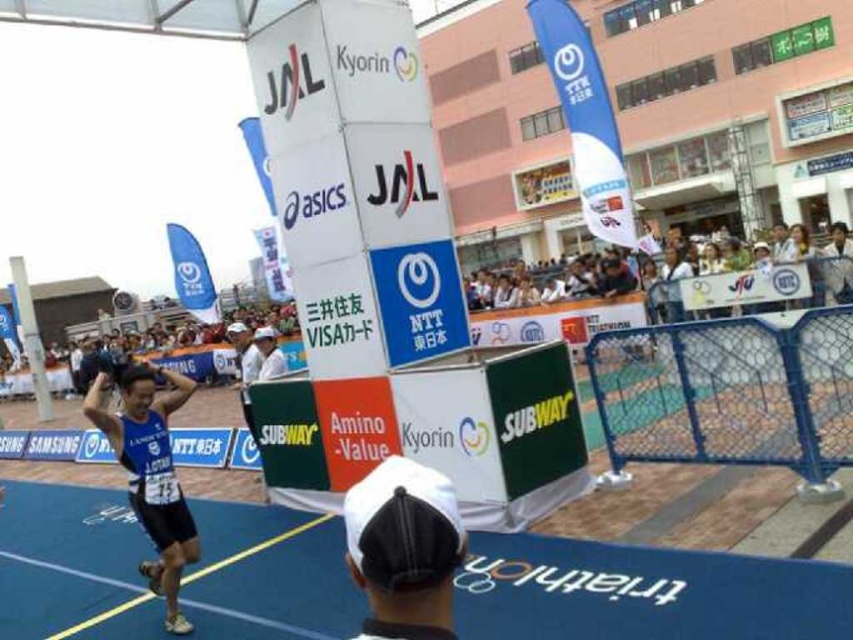
Question: Which of the following is the closest to the observer?

Choices:
 (A) white fabric shirt at center
 (B) blue fabric jersey at left
 (C) white matte cap at lower center

Answer: (C)

Question: Among these points, which one is farthest from the camera?

Choices:
 (A) (170, 528)
 (B) (244, 346)

Answer: (B)

Question: Which object appears closest to the camera in this image?

Choices:
 (A) white matte cap at lower center
 (B) blue fabric jersey at left

Answer: (A)

Question: Does white matte cap at lower center appear on the right side of blue fabric jersey at left?

Choices:
 (A) no
 (B) yes

Answer: (B)

Question: Does white matte cap at lower center have a greater width compared to blue fabric jersey at left?

Choices:
 (A) yes
 (B) no

Answer: (B)

Question: Is white matte cap at lower center positioned behind white fabric shirt at center?

Choices:
 (A) no
 (B) yes

Answer: (A)